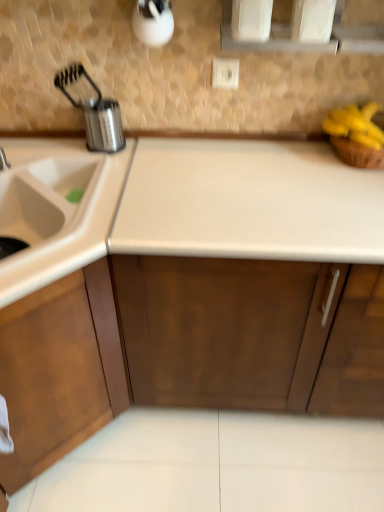
Question: From a real-world perspective, is white plastic electric outlet at upper center located beneath yellow matte bananas at upper right?

Choices:
 (A) yes
 (B) no

Answer: (B)

Question: Is white plastic electric outlet at upper center not close to yellow matte bananas at upper right?

Choices:
 (A) yes
 (B) no

Answer: (B)

Question: From the image's perspective, is white plastic electric outlet at upper center located above yellow matte bananas at upper right?

Choices:
 (A) yes
 (B) no

Answer: (A)

Question: Is white plastic electric outlet at upper center further to the viewer compared to yellow matte bananas at upper right?

Choices:
 (A) no
 (B) yes

Answer: (B)

Question: Does white plastic electric outlet at upper center have a greater width compared to yellow matte bananas at upper right?

Choices:
 (A) yes
 (B) no

Answer: (B)

Question: Does white plastic electric outlet at upper center have a smaller size compared to yellow matte bananas at upper right?

Choices:
 (A) yes
 (B) no

Answer: (A)

Question: Could brushed metal faucet at left be considered to be inside metallic silver canister at upper left?

Choices:
 (A) no
 (B) yes

Answer: (A)

Question: From the image's perspective, would you say metallic silver canister at upper left is shown under brushed metal faucet at left?

Choices:
 (A) no
 (B) yes

Answer: (A)

Question: Would you consider metallic silver canister at upper left to be distant from brushed metal faucet at left?

Choices:
 (A) no
 (B) yes

Answer: (A)

Question: Considering the relative sizes of metallic silver canister at upper left and brushed metal faucet at left in the image provided, is metallic silver canister at upper left shorter than brushed metal faucet at left?

Choices:
 (A) yes
 (B) no

Answer: (B)

Question: Considering the relative sizes of metallic silver canister at upper left and brushed metal faucet at left in the image provided, is metallic silver canister at upper left wider than brushed metal faucet at left?

Choices:
 (A) no
 (B) yes

Answer: (B)

Question: Is metallic silver canister at upper left turned away from brushed metal faucet at left?

Choices:
 (A) yes
 (B) no

Answer: (B)

Question: Is wooden cabinet at left in contact with brushed metal faucet at left?

Choices:
 (A) no
 (B) yes

Answer: (A)